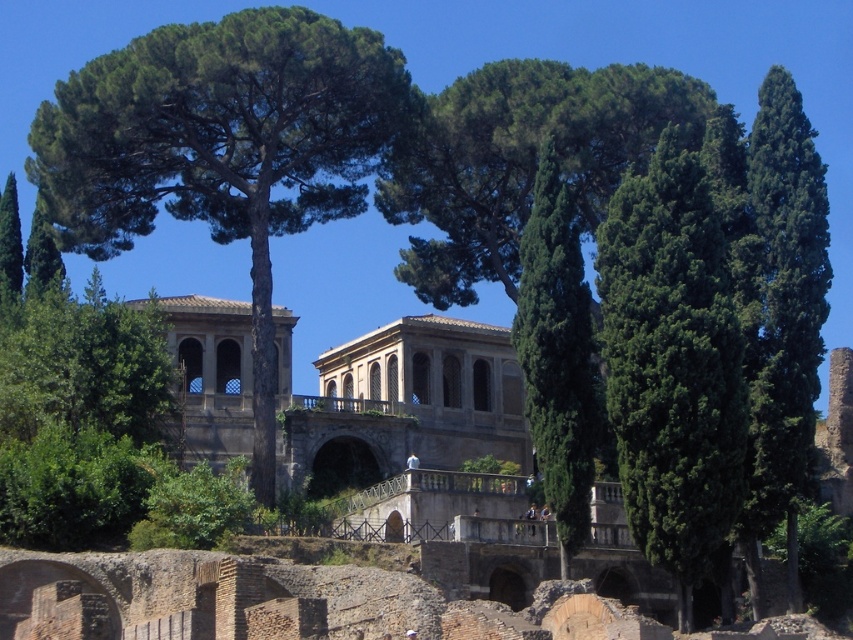
Question: Does green leafy tree at left have a larger size compared to green textured tree at center?

Choices:
 (A) yes
 (B) no

Answer: (A)

Question: Which of these objects is positioned closest to the green leafy tree at left?

Choices:
 (A) green textured tree at right
 (B) green leafy tree at right

Answer: (B)

Question: Is the position of green leafy tree at left less distant than that of green textured tree at right?

Choices:
 (A) no
 (B) yes

Answer: (A)

Question: Is green leafy tree at left thinner than green textured tree at center?

Choices:
 (A) no
 (B) yes

Answer: (A)

Question: Which of these objects is positioned farthest from the green leafy tree at right?

Choices:
 (A) green textured tree at right
 (B) green textured tree at center

Answer: (A)

Question: Which of the following is the farthest from the observer?

Choices:
 (A) green textured tree at center
 (B) green leafy tree at left

Answer: (B)